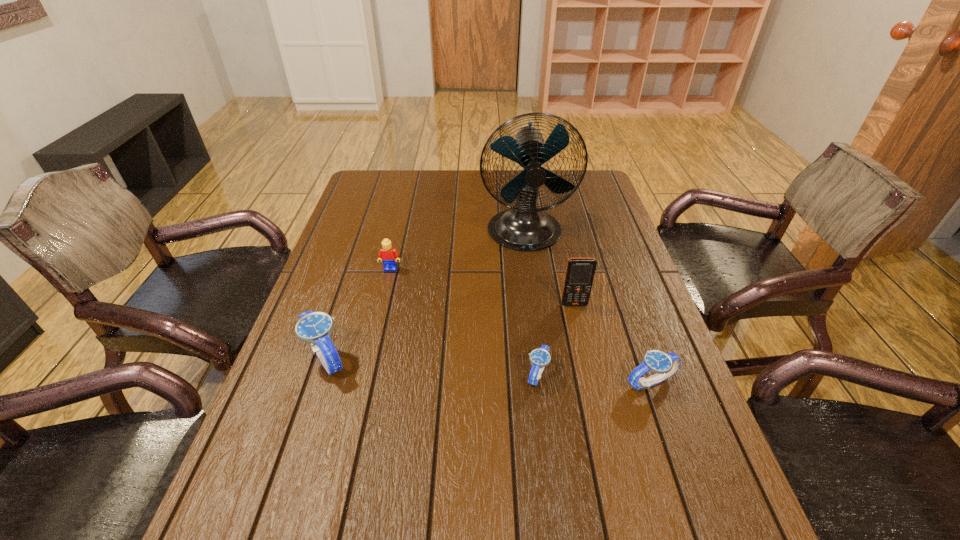
Locate an element on the screen. watch that is the closest to the second watch from left to right is located at coordinates (664, 364).

This screenshot has height=540, width=960. What are the coordinates of `watch that is the nearest to the fifth nearest object` in the screenshot? It's located at (315, 328).

I want to click on vacant space that satisfies the following two spatial constraints: 1. on the front-facing side of the second watch from left to right; 2. on the right side of the Lego, so click(366, 374).

Find the location of a particular element. This screenshot has width=960, height=540. vacant region that satisfies the following two spatial constraints: 1. on the front-facing side of the rightmost object; 2. on the right side of the farthest object is located at coordinates (544, 382).